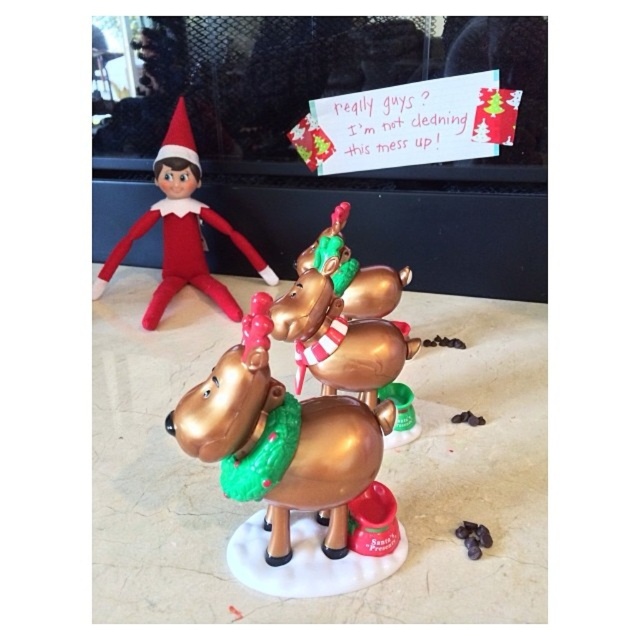
Question: Does velvety red elf at upper left have a larger size compared to metallic gold reindeer at center?

Choices:
 (A) yes
 (B) no

Answer: (A)

Question: Considering the relative positions of gold metallic reindeer at center and velvety red elf at upper left in the image provided, where is gold metallic reindeer at center located with respect to velvety red elf at upper left?

Choices:
 (A) left
 (B) right

Answer: (B)

Question: Estimate the real-world distances between objects in this image. Which object is farther from the metallic gold reindeer at center?

Choices:
 (A) gold metallic reindeer at center
 (B) velvety red elf at upper left

Answer: (B)

Question: Which point is closer to the camera?

Choices:
 (A) (262, 296)
 (B) (248, 458)
 (C) (168, 236)

Answer: (B)

Question: Among these points, which one is farthest from the camera?

Choices:
 (A) (196, 396)
 (B) (244, 323)

Answer: (A)

Question: Is the position of gold metallic reindeer at center less distant than that of velvety red elf at upper left?

Choices:
 (A) no
 (B) yes

Answer: (B)